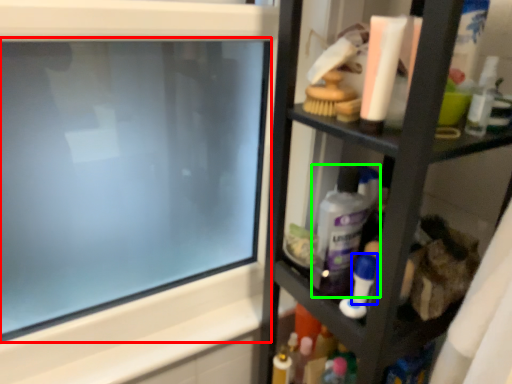
Question: Which object is the farthest from computer screen (highlighted by a red box)? Choose among these: toiletry (highlighted by a blue box) or cleaning product (highlighted by a green box).

Choices:
 (A) toiletry
 (B) cleaning product

Answer: (A)